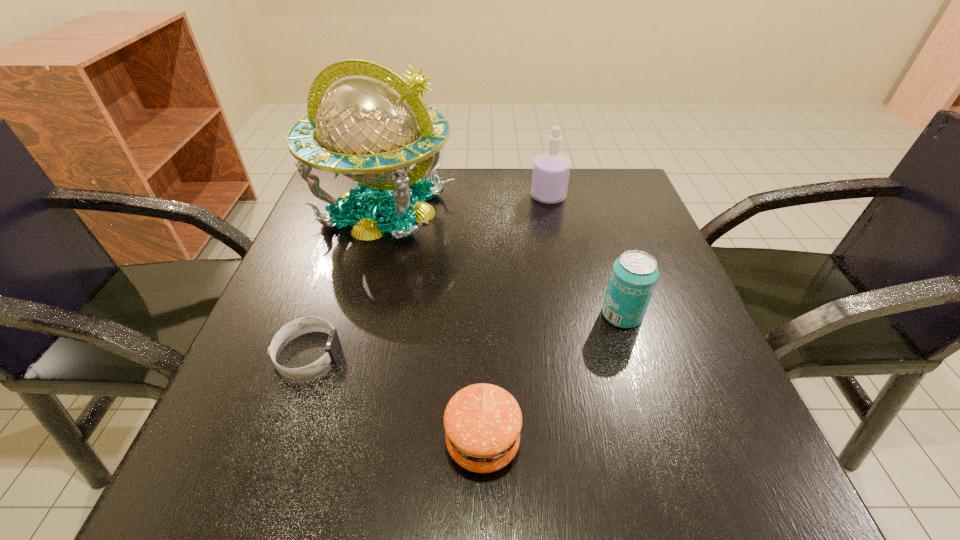
In the image, there is a desktop. Where is `free space at the far edge`? This screenshot has width=960, height=540. free space at the far edge is located at coordinates (502, 184).

Image resolution: width=960 pixels, height=540 pixels. Identify the location of free point at the near edge. (547, 498).

Image resolution: width=960 pixels, height=540 pixels. In the image, there is a desktop. In order to click on free region at the left edge in this screenshot , I will do `click(278, 424)`.

What are the coordinates of `vacant region at the right edge` in the screenshot? It's located at (603, 235).

The width and height of the screenshot is (960, 540). In the image, there is a desktop. What are the coordinates of `vacant area at the near left corner` in the screenshot? It's located at (226, 456).

Locate an element on the screen. free space at the far right corner of the desktop is located at coordinates (586, 183).

What are the coordinates of `free space at the near right corner of the desktop` in the screenshot? It's located at (694, 448).

Where is `free space between the third shortest object and the patty`? free space between the third shortest object and the patty is located at coordinates (552, 379).

Locate an element on the screen. This screenshot has height=540, width=960. free space between the fourth object from left to right and the patty is located at coordinates (516, 319).

Where is `vacant area that lies between the globe and the fourth tallest object`? vacant area that lies between the globe and the fourth tallest object is located at coordinates (433, 325).